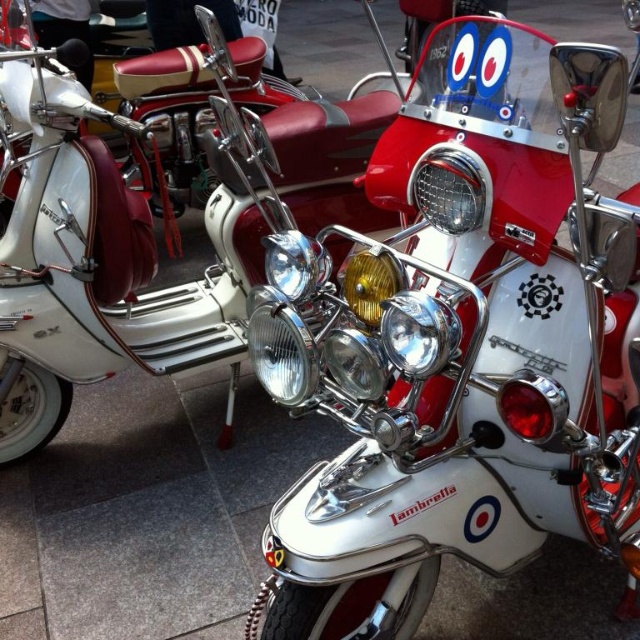
Based on the photo, does white chrome lambretta at center lie in front of white chrome scooter at center?

Yes, white chrome lambretta at center is closer to the viewer.

Does point (477, 97) come behind point (8, 374)?

No, (477, 97) is in front of (8, 374).

Locate an element on the screen. white chrome lambretta at center is located at coordinates (460, 342).